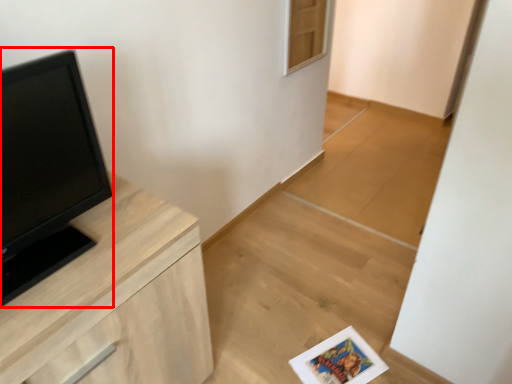
Question: From the image's perspective, what is the correct spatial positioning of open (annotated by the red box) in reference to chest of drawers?

Choices:
 (A) below
 (B) above

Answer: (B)